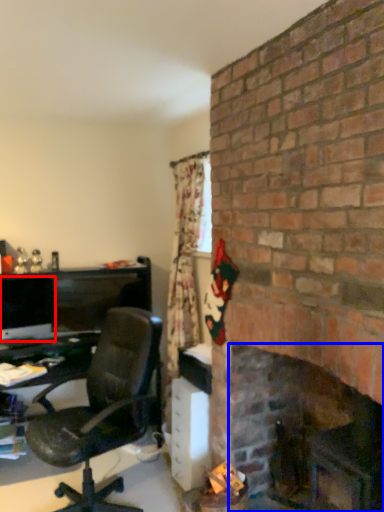
Question: Which point is further to the camera, computer monitor (highlighted by a red box) or fireplace (highlighted by a blue box)?

Choices:
 (A) computer monitor
 (B) fireplace

Answer: (A)